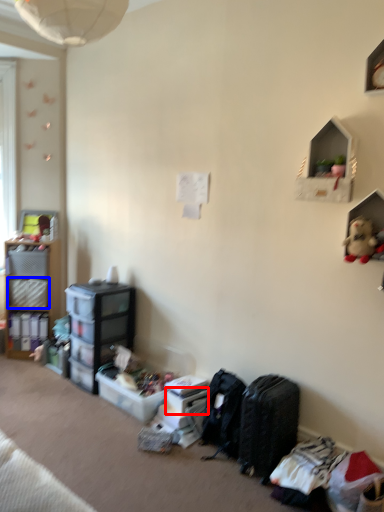
Question: Which object is closer to the camera taking this photo, storage box (highlighted by a red box) or storage box (highlighted by a blue box)?

Choices:
 (A) storage box
 (B) storage box

Answer: (A)